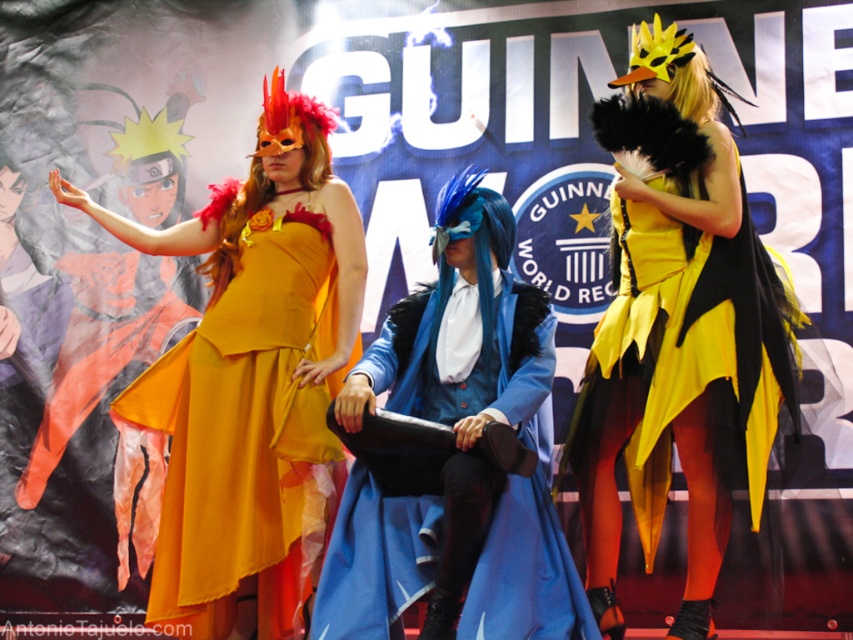
Does matte yellow dress at center appear over yellow satin dress at center?

Actually, matte yellow dress at center is below yellow satin dress at center.

Does matte yellow dress at center have a smaller size compared to yellow satin dress at center?

No.

Which is in front, point (263, 298) or point (723, 124)?

Positioned in front is point (723, 124).

At what (x,y) coordinates should I click in order to perform the action: click on matte yellow dress at center. Please return your answer as a coordinate pair (x, y). The height and width of the screenshot is (640, 853). Looking at the image, I should click on (248, 385).

From the picture: Does yellow satin dress at center have a greater height compared to blue velvet coat at center?

Yes.

Find the location of a particular element. This screenshot has height=640, width=853. yellow satin dress at center is located at coordinates (677, 330).

Does matte yellow dress at center have a lesser width compared to blue velvet coat at center?

In fact, matte yellow dress at center might be wider than blue velvet coat at center.

Based on the photo, is matte yellow dress at center positioned before blue velvet coat at center?

No.

Between point (224, 358) and point (387, 628), which one is positioned behind?

Positioned behind is point (224, 358).

Identify the location of matte yellow dress at center. This screenshot has width=853, height=640. (248, 385).